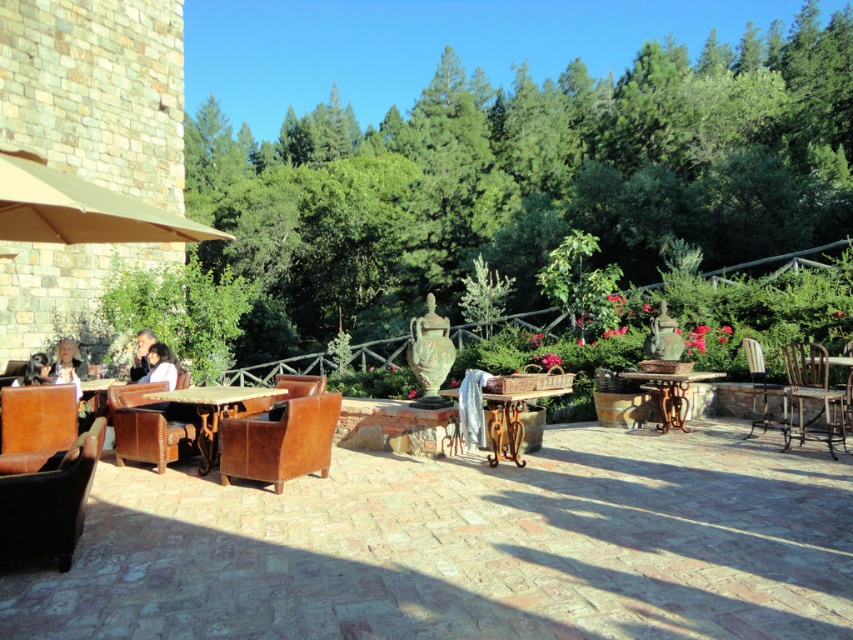
Question: Which object is positioned closest to the leather jacket at lower left?

Choices:
 (A) blonde hair at left
 (B) brown leather chair at right

Answer: (A)

Question: Which object is positioned farthest from the green leafy tree at upper center?

Choices:
 (A) light brown leather chair at left
 (B) leather at left
 (C) wooden chair at right

Answer: (A)

Question: Is leather chair at center behind light brown leather chair at left?

Choices:
 (A) yes
 (B) no

Answer: (B)

Question: Is leather/wooden table at center closer to the viewer compared to brown leather chair at right?

Choices:
 (A) yes
 (B) no

Answer: (A)

Question: In this image, where is green leafy tree at upper center located relative to matte white shirt at left?

Choices:
 (A) below
 (B) above

Answer: (B)

Question: Based on their relative distances, which object is nearer to the blonde hair at left?

Choices:
 (A) leather chair at center
 (B) brown leather chair at center

Answer: (A)